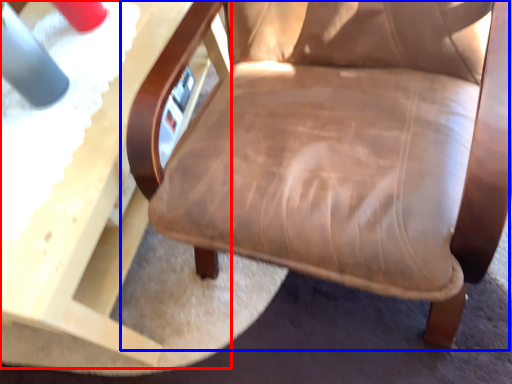
Question: Which object is closer to the camera taking this photo, table (highlighted by a red box) or chair (highlighted by a blue box)?

Choices:
 (A) table
 (B) chair

Answer: (B)